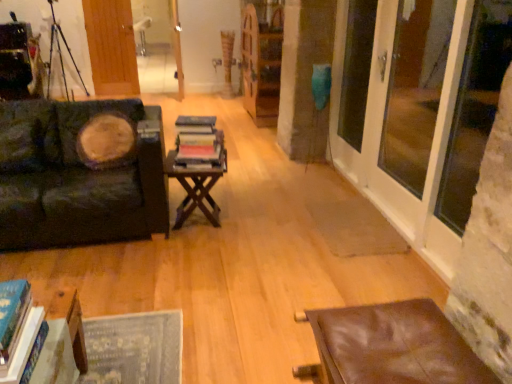
You are a GUI agent. You are given a task and a screenshot of the screen. Output one action in this format:
    pyautogui.click(x=<x>, y=<y>)
    Task: Click on the free space between transparent glass door at right, the 2th window screen positioned from the back, and velvet dark green couch at left
    
    Given the screenshot: What is the action you would take?
    pyautogui.click(x=278, y=225)